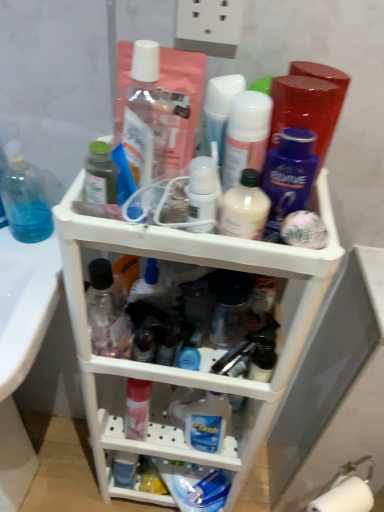
In order to click on empty space that is ontop of white plastic shelf at center in this screenshot , I will do `click(177, 224)`.